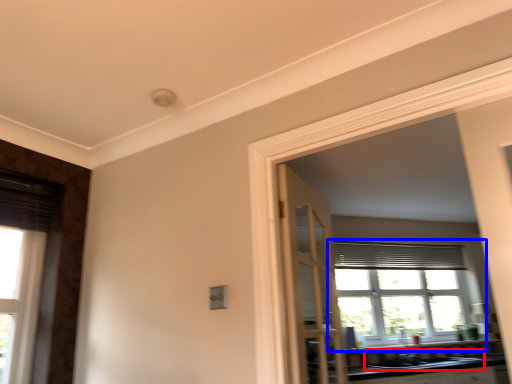
Question: Among these objects, which one is nearest to the camera, sink (highlighted by a red box) or window (highlighted by a blue box)?

Choices:
 (A) sink
 (B) window

Answer: (A)